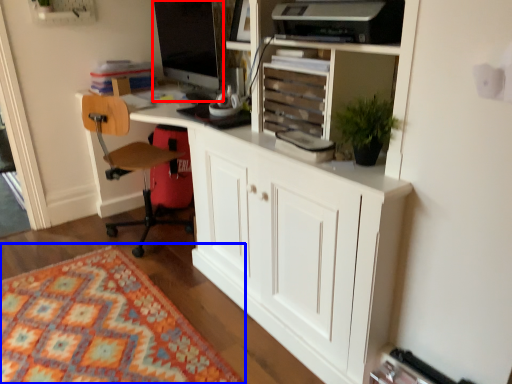
Question: Which object is closer to the camera taking this photo, computer monitor (highlighted by a red box) or mat (highlighted by a blue box)?

Choices:
 (A) computer monitor
 (B) mat

Answer: (B)